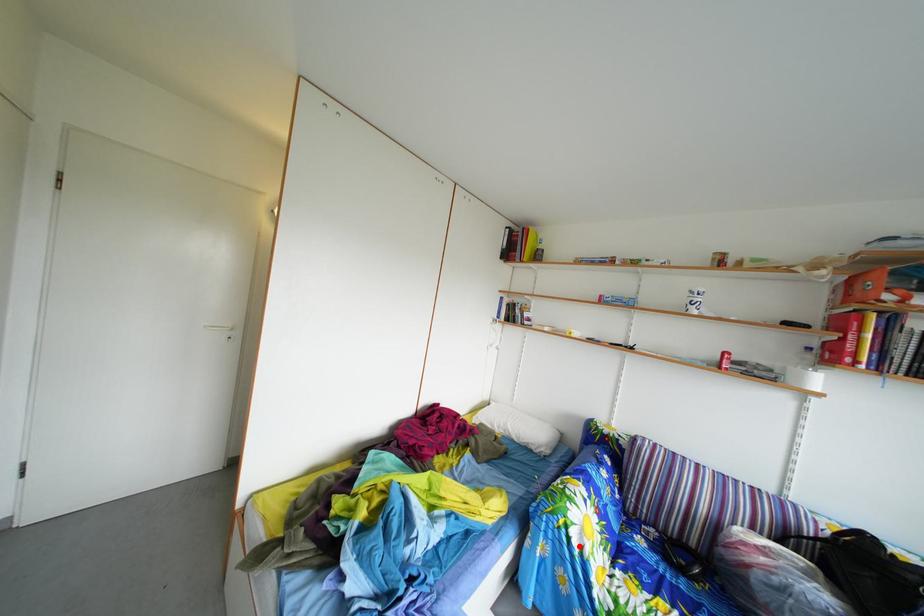
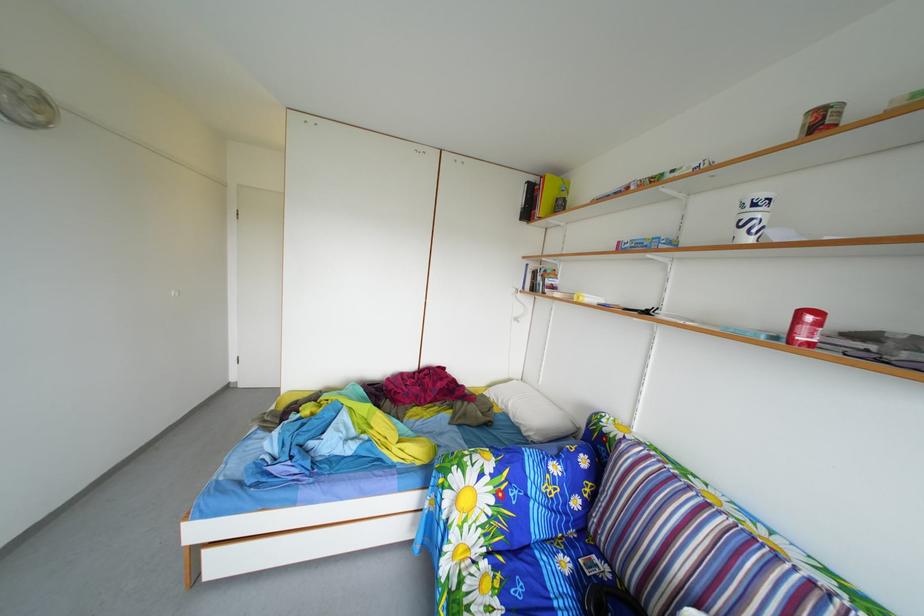
Question: I am providing you with two images of the same scene from different viewpoints. A red point is marked on the first image. Can you still see the location of the red point in image 2?

Choices:
 (A) Yes
 (B) No

Answer: (A)